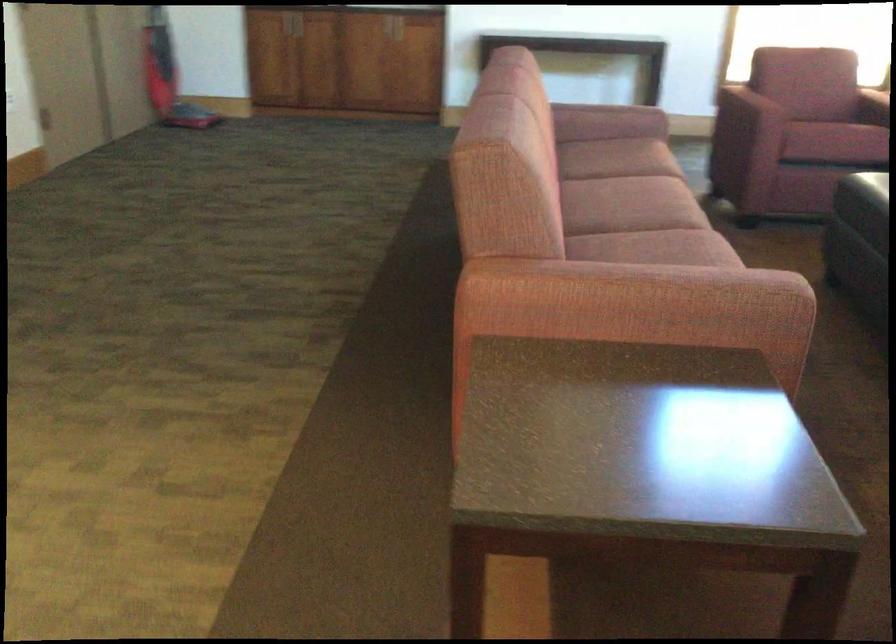
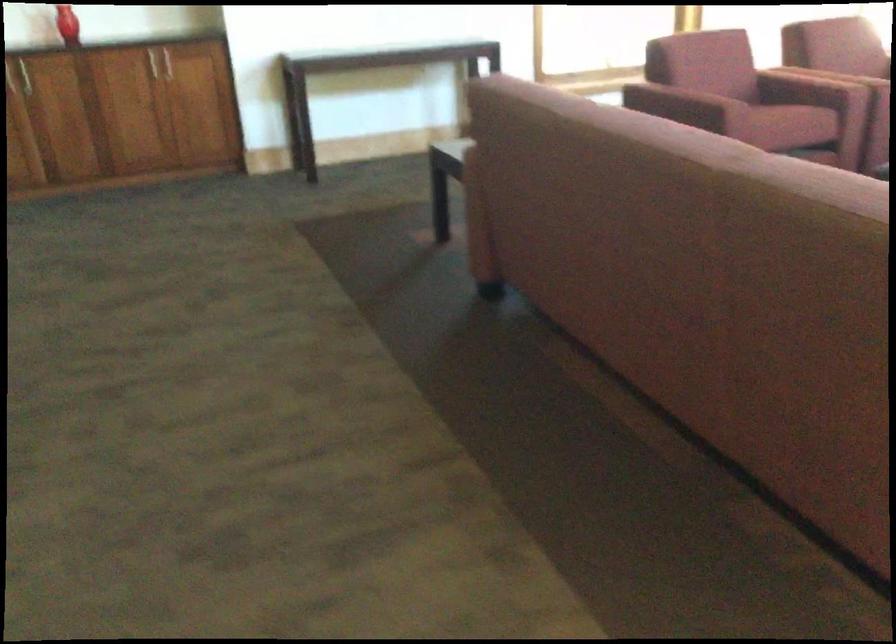
In a continuous first-person perspective shot, in which direction is the camera moving?

The cameraman walked toward left, forward.